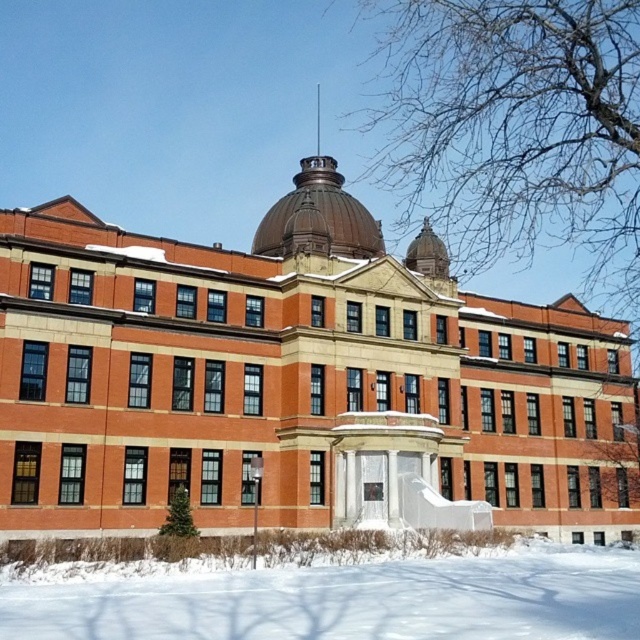
You are standing in front of the historic building and notice a specific point marked at coordinates (337, 600). What is present at this location?

The white powdery snow at lower center is located at point (337, 600).

Consider the image. You are standing in front of the historic building and want to take a photo that includes both the white powdery snow at lower center and the shiny brown dome at center. Which object will appear larger in the photo?

The white powdery snow at lower center will appear larger in the photo because it is closer to the viewer than the shiny brown dome at center.